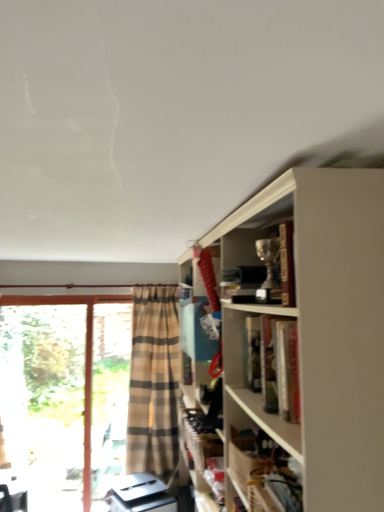
Question: From their relative heights in the image, would you say metallic trophy at upper right is taller or shorter than wooden shelf at lower right?

Choices:
 (A) short
 (B) tall

Answer: (B)

Question: Considering the positions of point pyautogui.click(x=240, y=229) and point pyautogui.click(x=289, y=441), is point pyautogui.click(x=240, y=229) closer or farther from the camera than point pyautogui.click(x=289, y=441)?

Choices:
 (A) closer
 (B) farther

Answer: (B)

Question: Which object is positioned closest to the wooden shelf at lower right?

Choices:
 (A) clear glass screen door at left
 (B) beige plaid curtain at left
 (C) transparent glass door at left
 (D) metallic trophy at upper right

Answer: (D)

Question: Which object is the farthest from the wooden shelf at lower right?

Choices:
 (A) beige plaid curtain at left
 (B) metallic trophy at upper right
 (C) transparent glass door at left
 (D) clear glass screen door at left

Answer: (C)